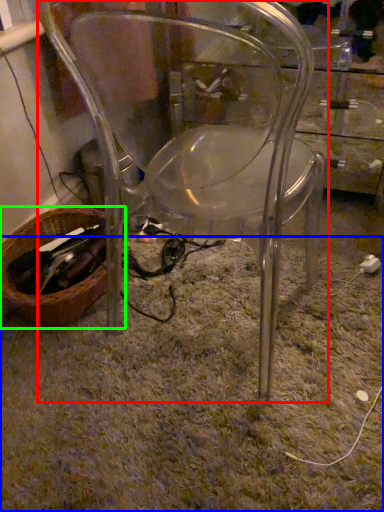
Question: Which is farther away from chair (highlighted by a red box)? grass (highlighted by a blue box) or basket (highlighted by a green box)?

Choices:
 (A) grass
 (B) basket

Answer: (B)